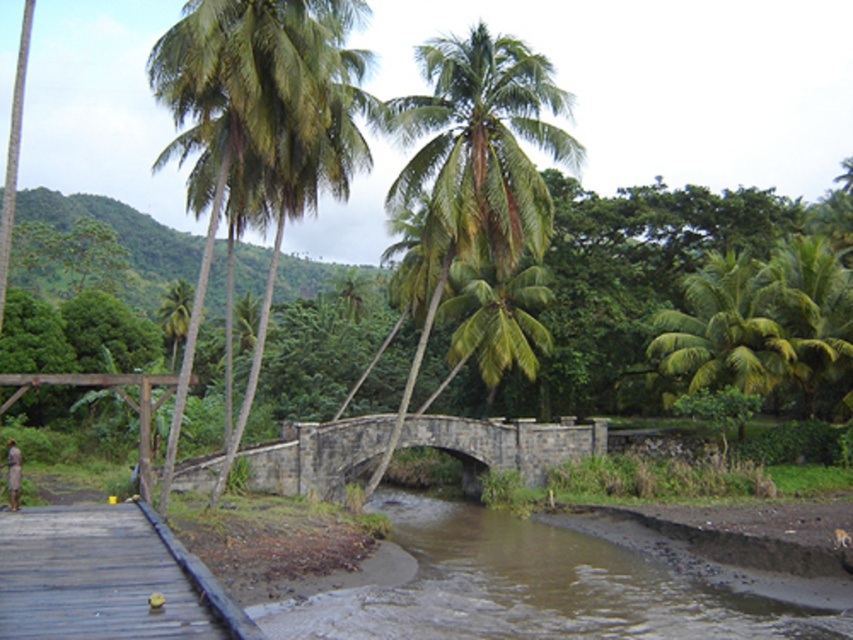
Who is more distant from viewer, (x=326, y=490) or (x=18, y=492)?

The point (x=326, y=490) is behind.

Is the position of stone bridge at center less distant than that of brown textured shirt at lower left?

No, it is behind brown textured shirt at lower left.

Which is behind, point (537, 476) or point (10, 458)?

Point (537, 476)

Image resolution: width=853 pixels, height=640 pixels. I want to click on stone bridge at center, so point(505,444).

Does brown muddy water at lower center appear on the right side of brown textured shirt at lower left?

Correct, you'll find brown muddy water at lower center to the right of brown textured shirt at lower left.

Who is lower down, brown muddy water at lower center or brown textured shirt at lower left?

brown muddy water at lower center is lower down.

Which is behind, point (833, 612) or point (18, 456)?

The point (18, 456) is more distant.

Image resolution: width=853 pixels, height=640 pixels. Identify the location of brown muddy water at lower center. (537, 588).

Is the position of green leafy coconut trees at upper left more distant than that of stone bridge at center?

No, green leafy coconut trees at upper left is closer to the viewer.

Is green leafy coconut trees at upper left closer to camera compared to stone bridge at center?

Yes, it is in front of stone bridge at center.

Is point (318, 52) positioned before point (257, 483)?

Yes, it is in front of point (257, 483).

Locate an element on the screen. This screenshot has height=640, width=853. green leafy coconut trees at upper left is located at coordinates (260, 109).